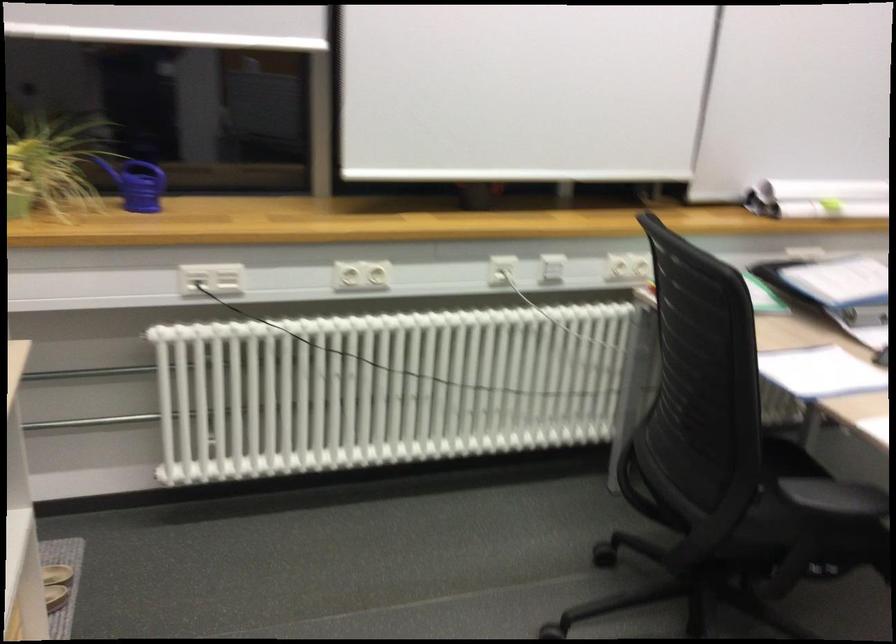
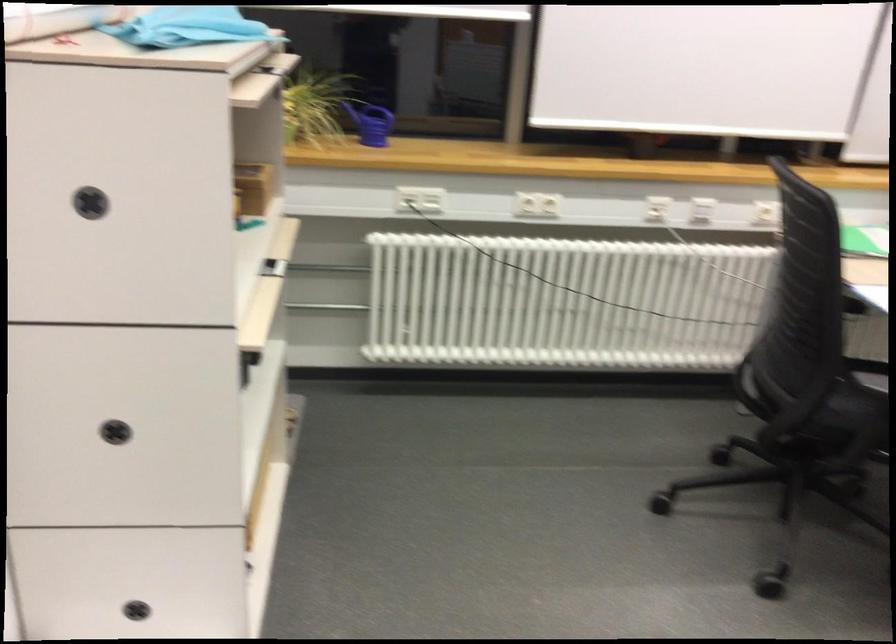
Locate, in the second image, the point that corresponds to point 360,279 in the first image.

(537, 205)